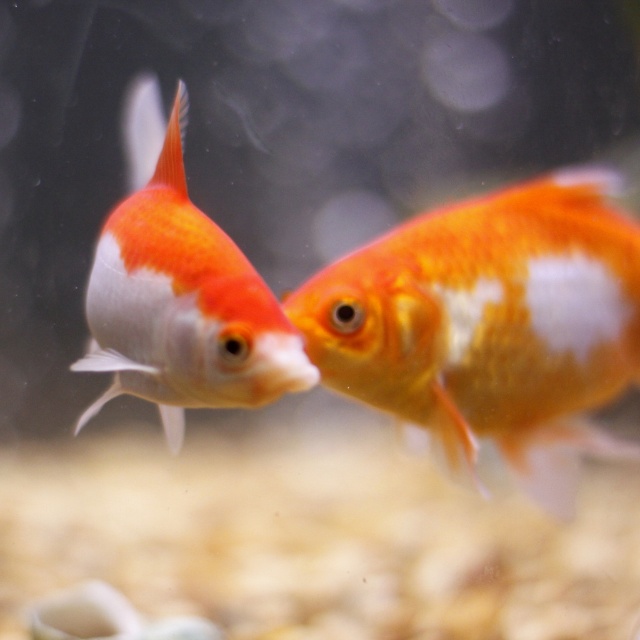
You are a photographer trying to capture a closeup of the shiny orange and white goldfish at center and the shiny orange and white fish at left. Which fish is closer to the camera?

The shiny orange and white goldfish at center is closer to the camera than the shiny orange and white fish at left.

You are an aquarium caretaker who needs to ensure both fish have enough space. Given that the tank requires each fish to have at least 10 cm of vertical space, can you determine if the shiny orange and white goldfish at center and the shiny orange and white fish at left can coexist in the tank based on their sizes?

The shiny orange and white goldfish at center is shorter than the shiny orange and white fish at left. Since the tank requires each fish to have at least 10 cm of vertical space, both fish can coexist as long as their combined height does not exceed the tank height. However, the exact tank dimensions are not provided, so we cannot confirm if they meet the requirement without additional information.